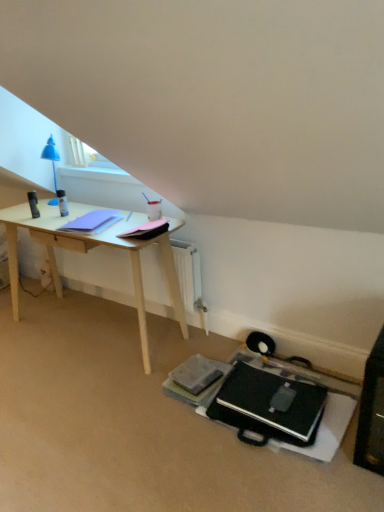
Question: Considering the relative sizes of black matte laptop at lower center and pink matte notepad at center, which appears as the 1th notepad when viewed from the right, in the image provided, is black matte laptop at lower center taller than pink matte notepad at center, which appears as the 1th notepad when viewed from the right,?

Choices:
 (A) yes
 (B) no

Answer: (A)

Question: Is black matte laptop at lower center touching pink matte notepad at center, the 2th notepad positioned from the left?

Choices:
 (A) no
 (B) yes

Answer: (A)

Question: Is black matte laptop at lower center turned away from pink matte notepad at center, the 2th notepad positioned from the left?

Choices:
 (A) no
 (B) yes

Answer: (A)

Question: Is black matte laptop at lower center facing towards pink matte notepad at center, which appears as the 1th notepad when viewed from the right?

Choices:
 (A) no
 (B) yes

Answer: (A)

Question: Considering the relative positions of black matte laptop at lower center and pink matte notepad at center, the 2th notepad positioned from the left, in the image provided, is black matte laptop at lower center to the left of pink matte notepad at center, the 2th notepad positioned from the left, from the viewer's perspective?

Choices:
 (A) yes
 (B) no

Answer: (B)

Question: From a real-world perspective, relative to matte purple notepad at left, the first notepad from the left, is pink matte notepad at center, the 2th notepad positioned from the left, vertically above or below?

Choices:
 (A) below
 (B) above

Answer: (B)

Question: Looking at the image, does pink matte notepad at center, the 2th notepad positioned from the left, seem bigger or smaller compared to matte purple notepad at left, the 2th notepad viewed from the right?

Choices:
 (A) big
 (B) small

Answer: (B)

Question: Is pink matte notepad at center, the 2th notepad positioned from the left, in front of or behind matte purple notepad at left, the first notepad from the left, in the image?

Choices:
 (A) behind
 (B) front

Answer: (B)

Question: Is pink matte notepad at center, which appears as the 1th notepad when viewed from the right, taller or shorter than matte purple notepad at left, the 2th notepad viewed from the right?

Choices:
 (A) tall
 (B) short

Answer: (A)

Question: From a real-world perspective, is matte purple notepad at left, the first notepad from the left, above or below black matte laptop at lower center?

Choices:
 (A) below
 (B) above

Answer: (B)

Question: From the image's perspective, relative to black matte laptop at lower center, is matte purple notepad at left, the first notepad from the left, above or below?

Choices:
 (A) below
 (B) above

Answer: (B)

Question: Does point coord(57,227) appear closer or farther from the camera than point coord(301,423)?

Choices:
 (A) closer
 (B) farther

Answer: (B)

Question: Looking at their shapes, would you say matte purple notepad at left, the 2th notepad viewed from the right, is wider or thinner than black matte laptop at lower center?

Choices:
 (A) thin
 (B) wide

Answer: (A)

Question: Is black matte laptop at lower center wider or thinner than pink matte notepad at center, the 2th notepad positioned from the left?

Choices:
 (A) thin
 (B) wide

Answer: (B)

Question: From the image's perspective, relative to pink matte notepad at center, the 2th notepad positioned from the left, is black matte laptop at lower center above or below?

Choices:
 (A) below
 (B) above

Answer: (A)